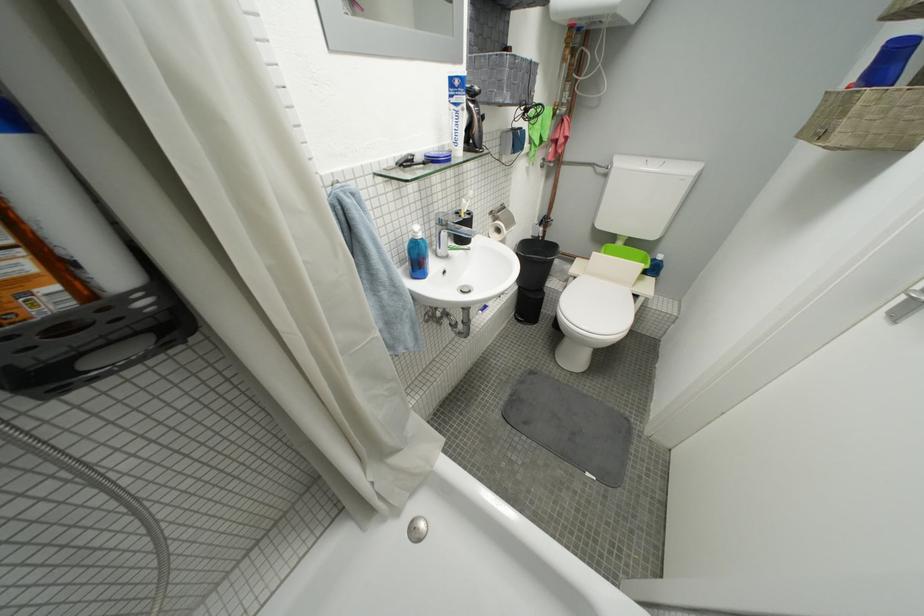
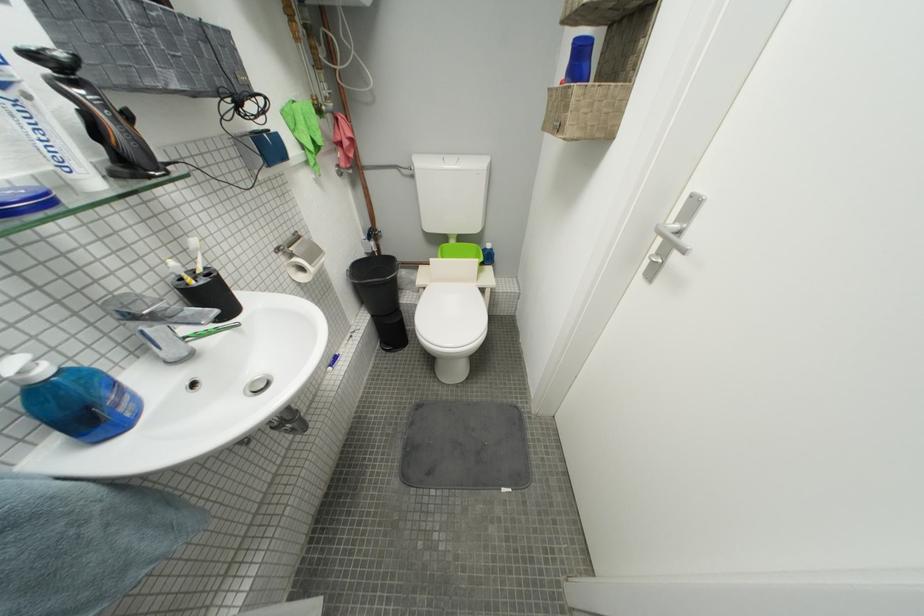
Where in the second image is the point corresponding to pixel 516 229 from the first image?

(320, 265)